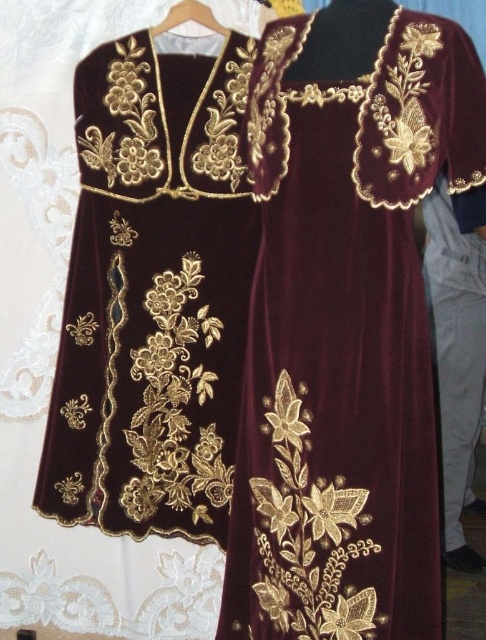
Question: Observing the image, what is the correct spatial positioning of velvet burgundy dress at center in reference to velvet gold embroidered dress at center?

Choices:
 (A) left
 (B) right

Answer: (B)

Question: Does velvet gold embroidered dress at center have a greater width compared to wooden hanger at upper center?

Choices:
 (A) no
 (B) yes

Answer: (B)

Question: Observing the image, what is the correct spatial positioning of velvet burgundy dress at center in reference to velvet gold embroidered dress at center?

Choices:
 (A) left
 (B) right

Answer: (B)

Question: Which of the following is the closest to the observer?

Choices:
 (A) velvet gold embroidered dress at center
 (B) wooden hanger at upper center

Answer: (B)

Question: Which object appears farthest from the camera in this image?

Choices:
 (A) velvet gold embroidered dress at center
 (B) wooden hanger at upper center
 (C) velvet burgundy dress at center

Answer: (A)

Question: Estimate the real-world distances between objects in this image. Which object is closer to the wooden hanger at upper center?

Choices:
 (A) velvet burgundy dress at center
 (B) velvet gold embroidered dress at center

Answer: (B)